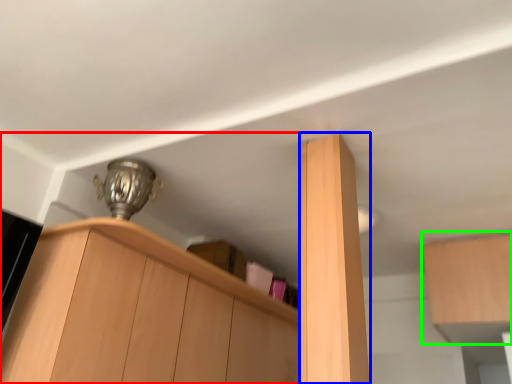
Question: Based on their relative distances, which object is farther from cabinetry (highlighted by a red box)? Choose from cabinetry (highlighted by a blue box) and cabinetry (highlighted by a green box).

Choices:
 (A) cabinetry
 (B) cabinetry

Answer: (B)